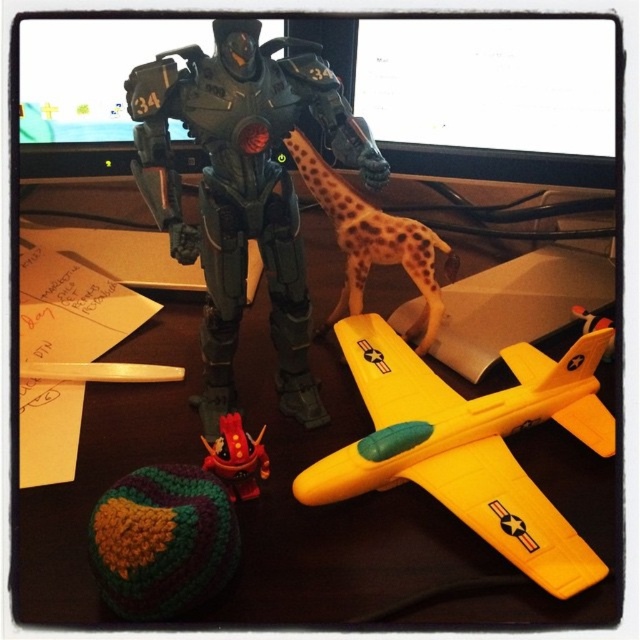
You are organizing a desk and need to place a new item between the yellow matte airplane at center and the rubberized red robot at lower center. Based on their positions, where should you place the new item?

The yellow matte airplane at center is located above the rubberized red robot at lower center, so you should place the new item between them by positioning it below the airplane and above the robot.

You are a child playing with the multicolored knitted ball at lower left and the rubberized red robot at lower center on a desk. You want to roll the ball towards the robot. Is the ball within a 5 inch radius of the robot?

The distance between the multicolored knitted ball at lower left and the rubberized red robot at lower center is 4.48 inches, which is within the 5 inch radius. Therefore, the ball is close enough to roll towards the robot.

You are organizing a toy drive and need to determine which toys are in the foreground. You have a multicolored knitted ball at lower left and a rubberized red robot at lower center. Which of these two toys is closer to you?

The multicolored knitted ball at lower left is closer to the viewer than the rubberized red robot at lower center.